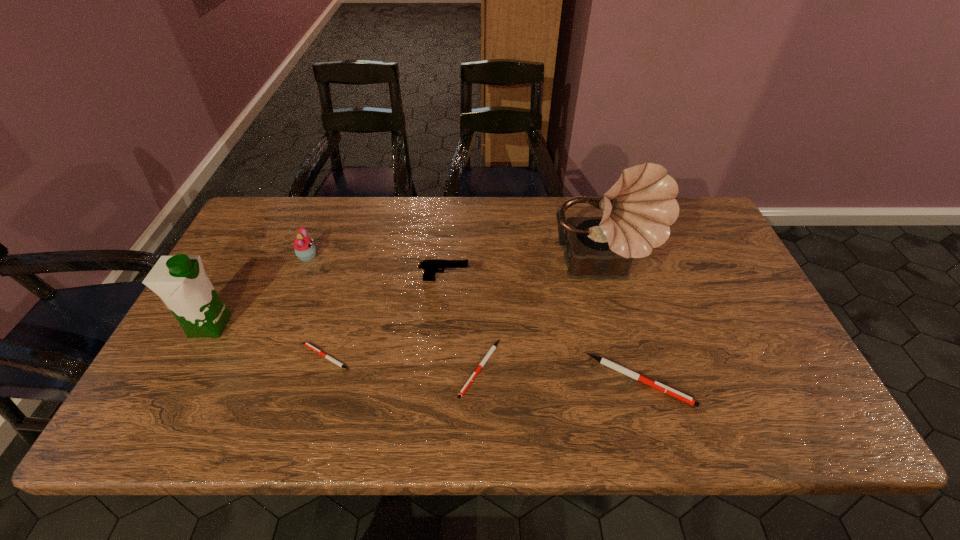
At what (x,y) coordinates should I click in order to perform the action: click on the shortest object. Please return your answer as a coordinate pair (x, y). This screenshot has width=960, height=540. Looking at the image, I should click on (326, 356).

At what (x,y) coordinates should I click in order to perform the action: click on the shortest pen. Please return your answer as a coordinate pair (x, y). The width and height of the screenshot is (960, 540). Looking at the image, I should click on (326, 356).

Where is `the sixth tallest object`? This screenshot has width=960, height=540. the sixth tallest object is located at coordinates (489, 353).

Image resolution: width=960 pixels, height=540 pixels. What are the coordinates of `the second shortest pen` in the screenshot? It's located at (489, 353).

Identify the location of the fifth tallest object. (610, 364).

Where is `the rightmost pen`? This screenshot has width=960, height=540. the rightmost pen is located at coordinates (610, 364).

This screenshot has width=960, height=540. I want to click on cupcake, so click(x=305, y=250).

This screenshot has height=540, width=960. In order to click on the fifth shortest object in this screenshot , I will do `click(305, 250)`.

Where is `record player`? The width and height of the screenshot is (960, 540). record player is located at coordinates (638, 210).

The height and width of the screenshot is (540, 960). What are the coordinates of `the second tallest object` in the screenshot? It's located at (180, 281).